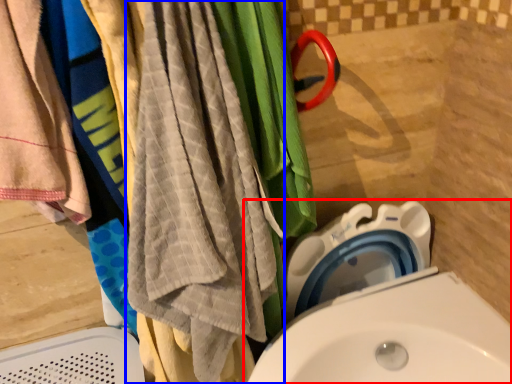
Question: Which of the following is the farthest to the observer, toilet (highlighted by a red box) or beach towel (highlighted by a blue box)?

Choices:
 (A) toilet
 (B) beach towel

Answer: (A)